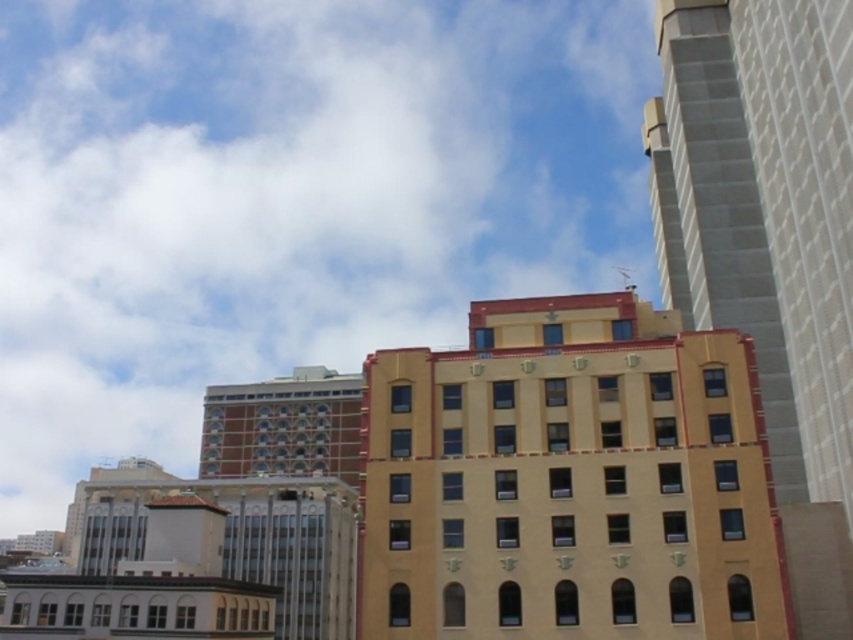
Is yellow matte building at center behind smooth concrete skyscraper at right?

That is False.

Looking at this image, does yellow matte building at center have a larger size compared to smooth concrete skyscraper at right?

Incorrect, yellow matte building at center is not larger than smooth concrete skyscraper at right.

This screenshot has width=853, height=640. In order to click on yellow matte building at center in this screenshot , I will do `click(569, 481)`.